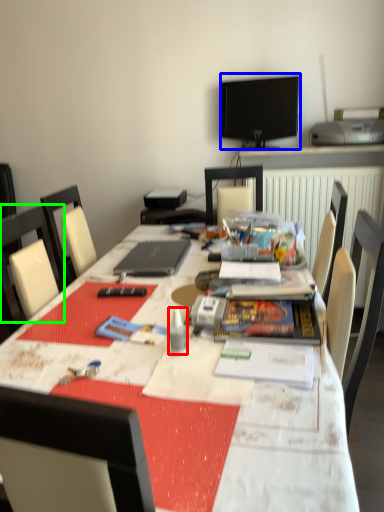
Question: Which object is the closest to the stationery (highlighted by a red box)? Choose among these: television (highlighted by a blue box) or chair (highlighted by a green box).

Choices:
 (A) television
 (B) chair

Answer: (B)